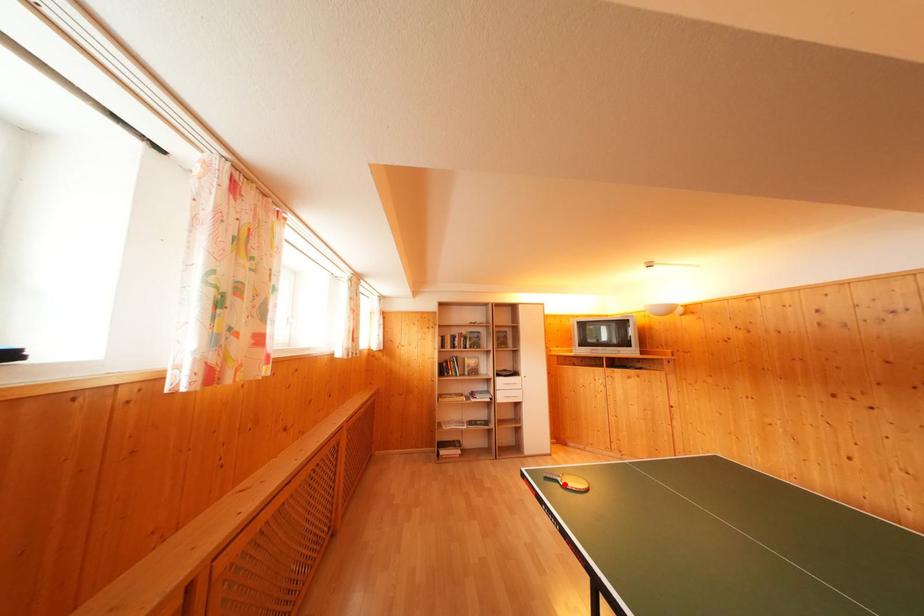
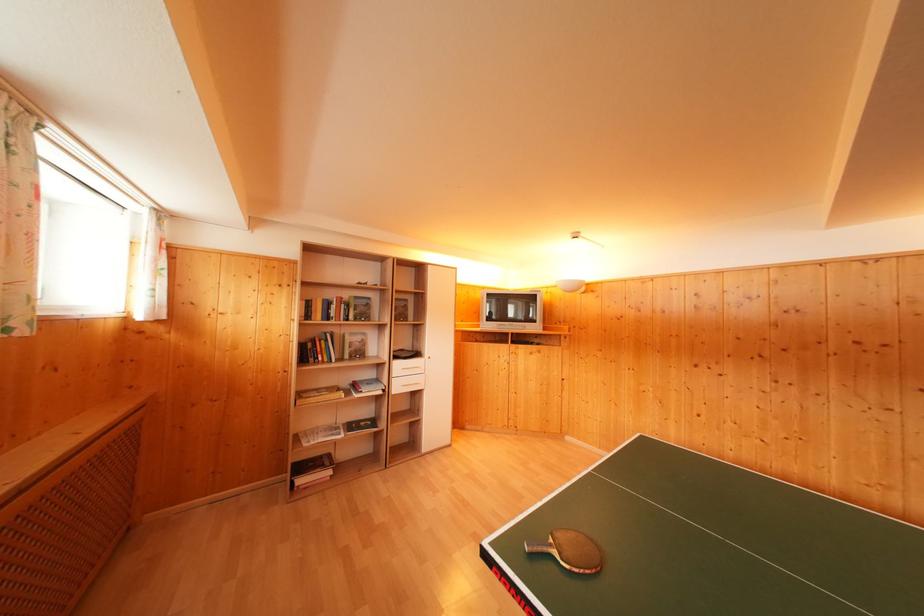
Question: I am providing you with two images of the same scene from different viewpoints. Given a red point in image1, look at the same physical point in image2. Is it:

Choices:
 (A) Closer to the viewpoint
 (B) Farther from the viewpoint

Answer: (B)